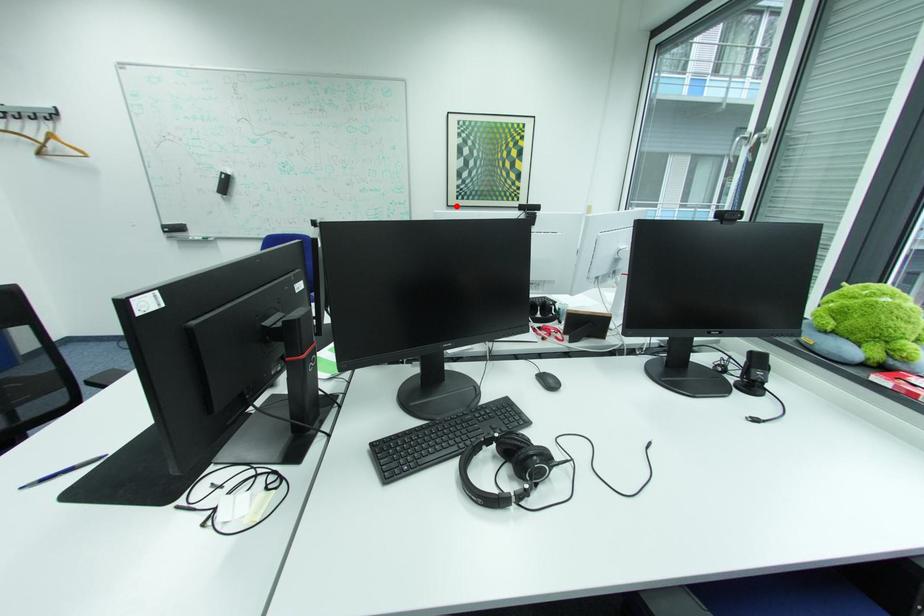
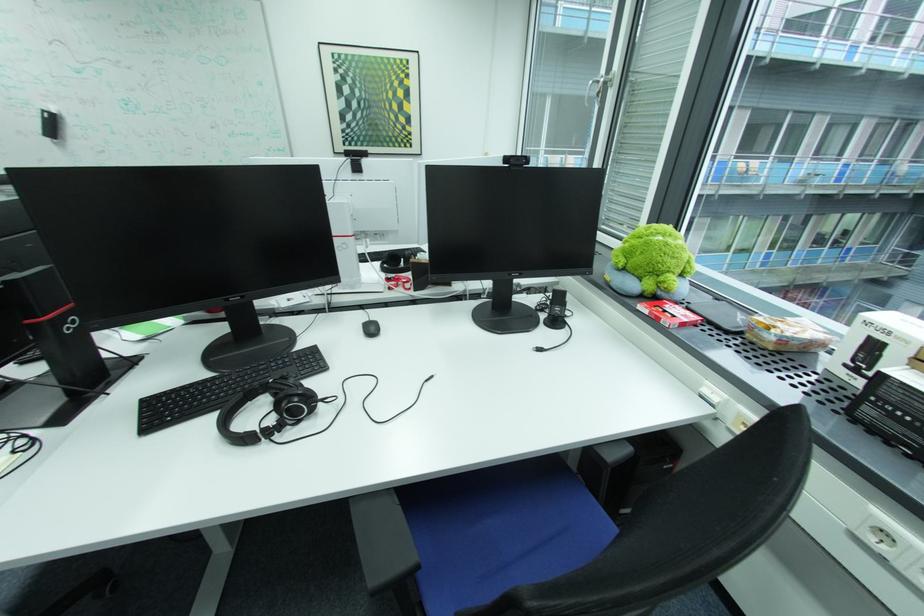
The point at the highlighted location is marked in the first image. Where is the corresponding point in the second image?

(344, 153)